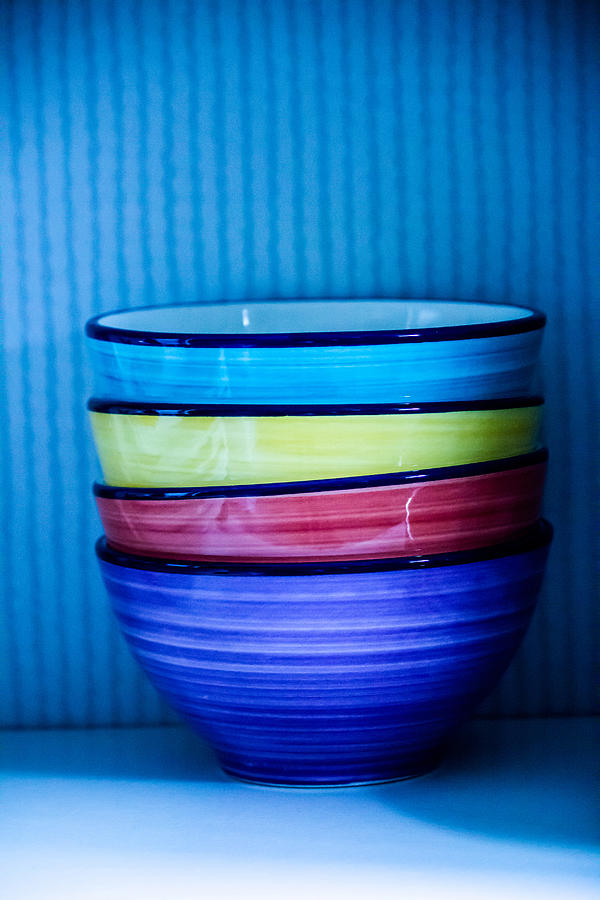
The height and width of the screenshot is (900, 600). I want to click on inside of bowl, so 303,313.